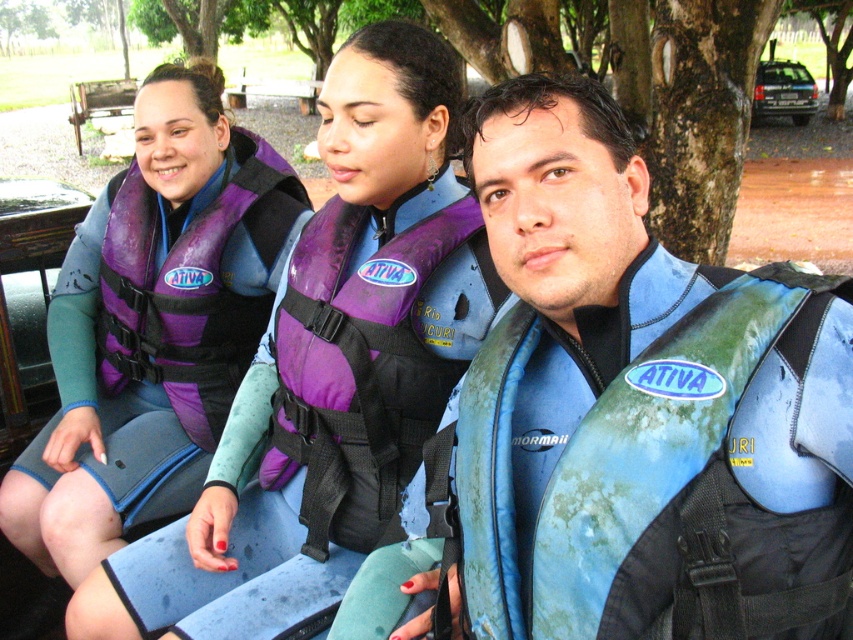
Question: Can you confirm if purple matte life vest at left is wider than purple matte life jacket at center?

Choices:
 (A) yes
 (B) no

Answer: (A)

Question: Can you confirm if blue-green textured life vest at center-right is smaller than purple matte life vest at center?

Choices:
 (A) no
 (B) yes

Answer: (B)

Question: Can you confirm if blue-green textured life vest at center-right is positioned to the right of purple matte life vest at left?

Choices:
 (A) no
 (B) yes

Answer: (B)

Question: Which is farther from the purple matte life vest at center?

Choices:
 (A) purple matte life vest at left
 (B) purple matte life jacket at center

Answer: (B)

Question: Which object is farther from the camera taking this photo?

Choices:
 (A) purple matte life jacket at center
 (B) purple matte life vest at center
 (C) blue-green textured life vest at center-right

Answer: (B)

Question: Which point appears farthest from the camera in this image?

Choices:
 (A) (399, 324)
 (B) (268, 273)

Answer: (B)